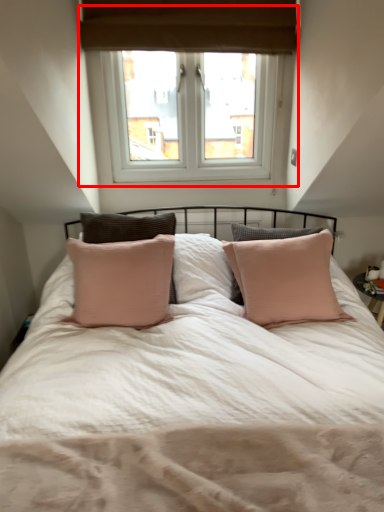
Question: From the image, what is the correct spatial relationship of window (annotated by the red box) in relation to mattress?

Choices:
 (A) right
 (B) left

Answer: (B)